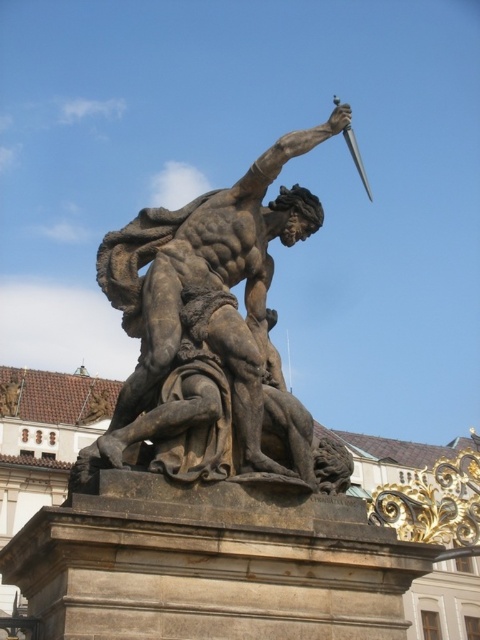
Which is more to the left, bronze statue at center or shiny silver sword at upper right?

bronze statue at center

Does bronze statue at center appear over shiny silver sword at upper right?

No, bronze statue at center is not above shiny silver sword at upper right.

Measure the distance between point (168,353) and camera.

Point (168,353) is 27.94 meters away from camera.

Identify the location of bronze statue at center. click(x=213, y=337).